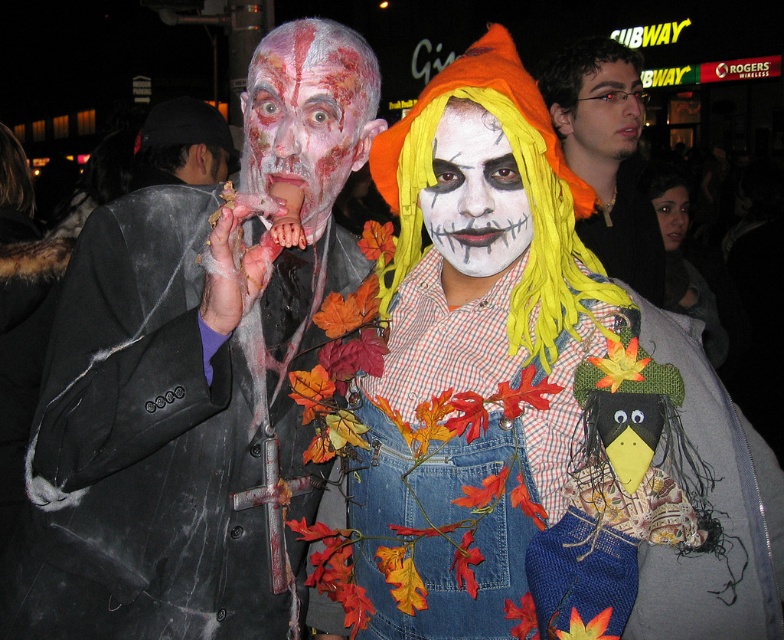
Question: Which of the following is the farthest from the observer?

Choices:
 (A) (98, 339)
 (B) (329, 140)

Answer: (B)

Question: Which point appears closest to the camera in this image?

Choices:
 (A) (514, 189)
 (B) (147, 120)

Answer: (A)

Question: Considering the real-world distances, which object is closest to the matte black hair at upper right?

Choices:
 (A) smooth skin face at center
 (B) white matte face paint at center

Answer: (A)

Question: Can you confirm if smooth skin face at upper center is positioned to the left of smooth skin face at center?

Choices:
 (A) yes
 (B) no

Answer: (A)

Question: Is black fabric at left below matte black face at center?

Choices:
 (A) no
 (B) yes

Answer: (B)

Question: Does matte black hair at upper center lie in front of smooth skin face at upper center?

Choices:
 (A) no
 (B) yes

Answer: (B)